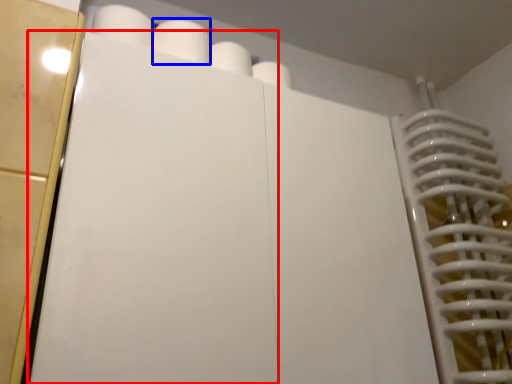
Question: Which object is further to the camera taking this photo, door (highlighted by a red box) or paper towel (highlighted by a blue box)?

Choices:
 (A) door
 (B) paper towel

Answer: (B)